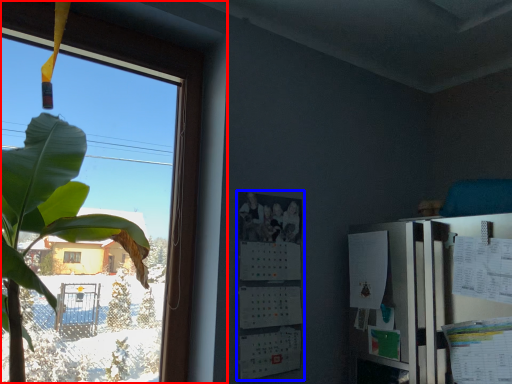
Question: Which of the following is the closest to the observer, window (highlighted by a red box) or bulletin board (highlighted by a blue box)?

Choices:
 (A) window
 (B) bulletin board

Answer: (A)